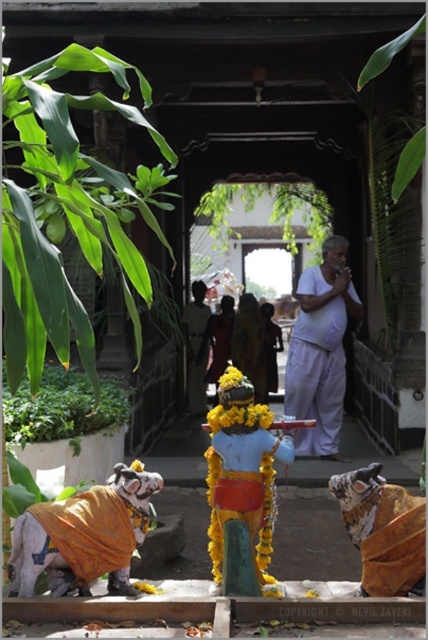
You are a photographer trying to capture a photo of the yellow fabric clothed dog at lower left and the yellow fabric garland at center. Which object should you focus on first if you want to ensure both are in focus without adjusting your camera settings?

The yellow fabric clothed dog at lower left has a lesser height compared to the yellow fabric garland at center, so focusing on the dog first would help maintain focus on both since it is closer to the camera.

You are a visitor in this temple scene. You see a white cotton monk at center and a dark brown fabric at center. Which object is located to the left of the other?

The dark brown fabric at center is located to the left of the white cotton monk at center.

You are a visitor in this temple scene. You see the white cotton monk at center and the dark brown fabric at center. Which object is above the other?

The dark brown fabric at center is above the white cotton monk at center because the white cotton monk at center is positioned under it.